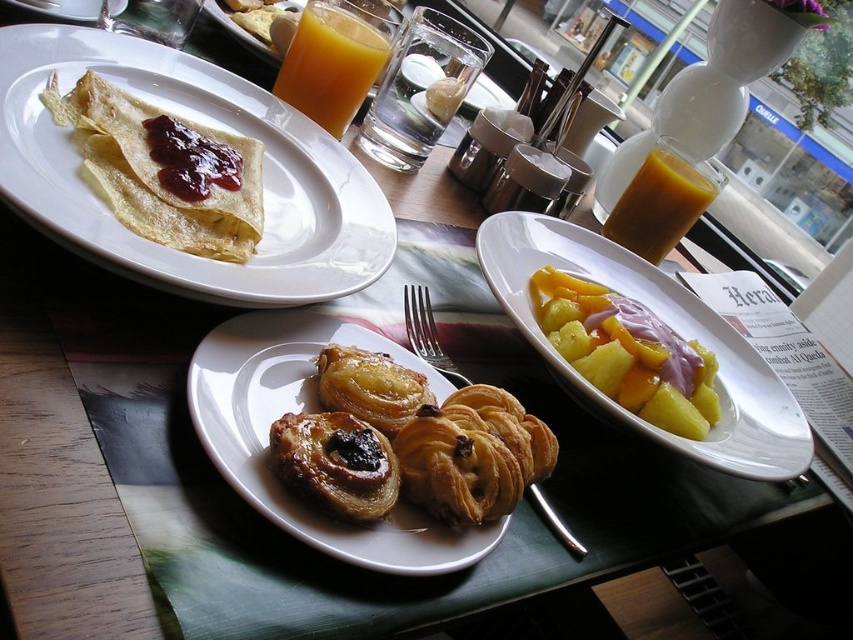
You are a customer at the breakfast table. You want to reach for the matte crepe at upper left without moving the yellow pineapple at center. Is this possible?

The matte crepe at upper left is in front of the yellow pineapple at center, so you can reach it without disturbing the pineapple.

You are a customer at the breakfast table and want to pour some orange juice from the translucent glass orange juice at upper center into a cup. However, you notice the shiny red jam at center nearby. Which container should you choose to pour the juice into, and why?

You should pour the juice into the translucent glass orange juice at upper center because it is larger in size compared to the shiny red jam at center, making it more suitable for holding liquid.

In the scene shown: You are a customer at the restaurant and want to locate the matte crepe at upper left. According to the coordinates provided, where exactly should you look on the image?

The matte crepe at upper left is located at point coordinates of (204, 124).